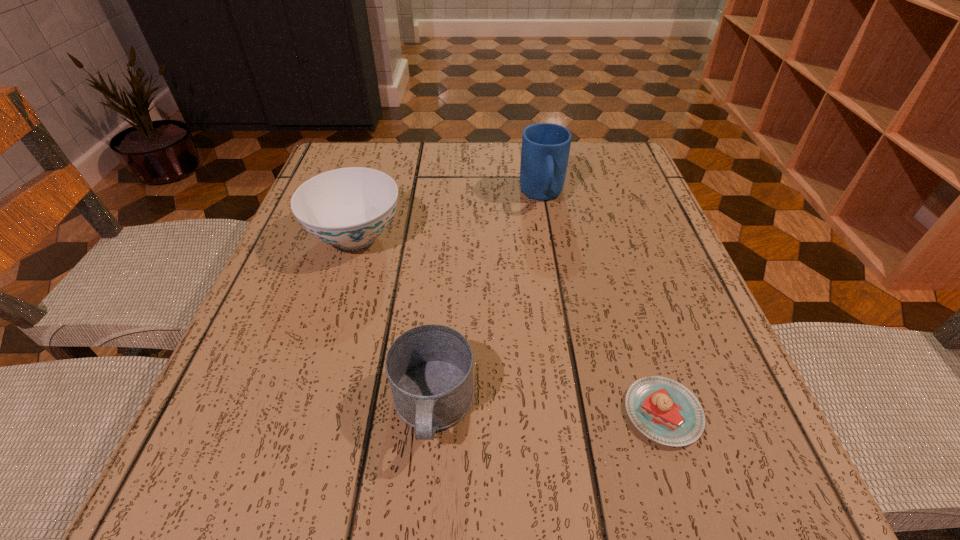
Locate an element on the screen. free spot between the farther mug and the shorter mug is located at coordinates (488, 301).

At what (x,y) coordinates should I click in order to perform the action: click on object that stands as the third closest to the shorter mug. Please return your answer as a coordinate pair (x, y). The image size is (960, 540). Looking at the image, I should click on (545, 149).

Locate which object is the second closest to the nearer mug. Please provide its 2D coordinates. Your answer should be formatted as a tuple, i.e. [(x, y)], where the tuple contains the x and y coordinates of a point satisfying the conditions above.

[(665, 411)]

Find the location of `vacant space that satisfies the following two spatial constraints: 1. on the side of the tallest object with the handle; 2. on the left side of the shortest object`. vacant space that satisfies the following two spatial constraints: 1. on the side of the tallest object with the handle; 2. on the left side of the shortest object is located at coordinates (579, 412).

You are a GUI agent. You are given a task and a screenshot of the screen. Output one action in this format:
    pyautogui.click(x=<x>, y=<y>)
    Task: Click on the blank area in the image that satisfies the following two spatial constraints: 1. on the side of the second object from right to left with the handle; 2. on the right side of the shortest object
    The width and height of the screenshot is (960, 540).
    Given the screenshot: What is the action you would take?
    pyautogui.click(x=579, y=412)

This screenshot has width=960, height=540. Find the location of `blank area in the image that satisfies the following two spatial constraints: 1. on the side of the second object from left to right with the handle; 2. on the right side of the shortest object`. blank area in the image that satisfies the following two spatial constraints: 1. on the side of the second object from left to right with the handle; 2. on the right side of the shortest object is located at coordinates (433, 412).

At what (x,y) coordinates should I click in order to perform the action: click on free location that satisfies the following two spatial constraints: 1. on the side of the nearer mug with the handle; 2. on the left side of the rightmost object. Please return your answer as a coordinate pair (x, y). Looking at the image, I should click on (433, 412).

This screenshot has height=540, width=960. I want to click on blank area in the image that satisfies the following two spatial constraints: 1. on the side of the taller mug with the handle; 2. on the left side of the shortest object, so click(579, 412).